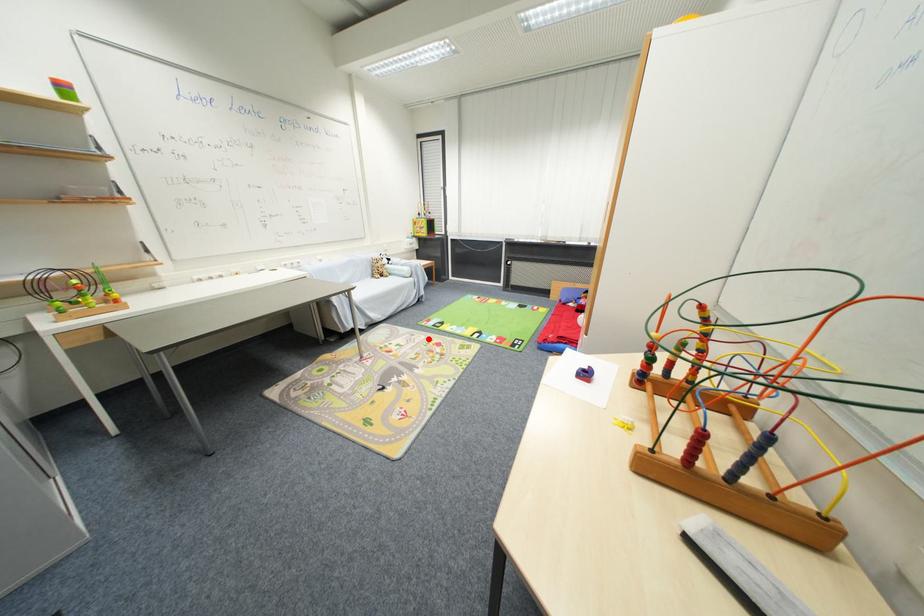
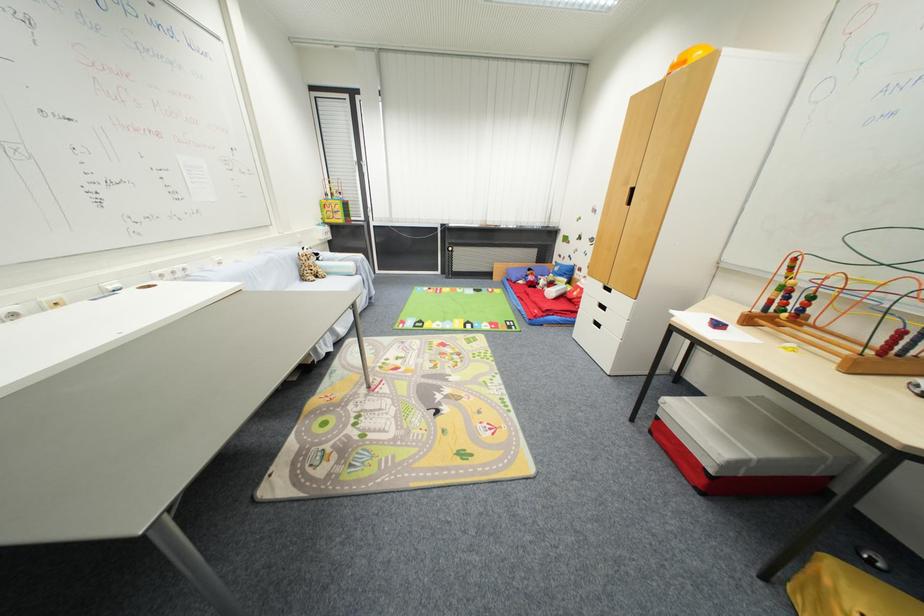
Question: I am providing you with two images of the same scene from different viewpoints. A red point is shown in image1. For the corresponding object point in image2, is it positioned nearer or farther from the camera?

Choices:
 (A) Nearer
 (B) Farther

Answer: (A)